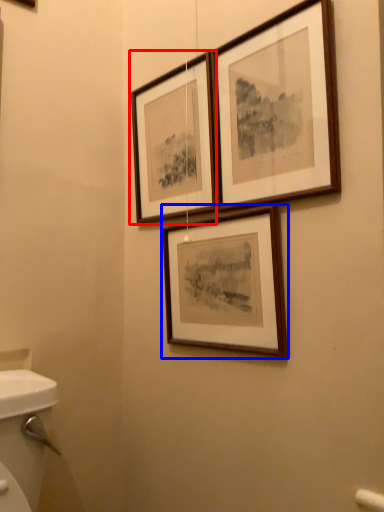
Question: Which point is closer to the camera, picture frame (highlighted by a red box) or picture frame (highlighted by a blue box)?

Choices:
 (A) picture frame
 (B) picture frame

Answer: (B)